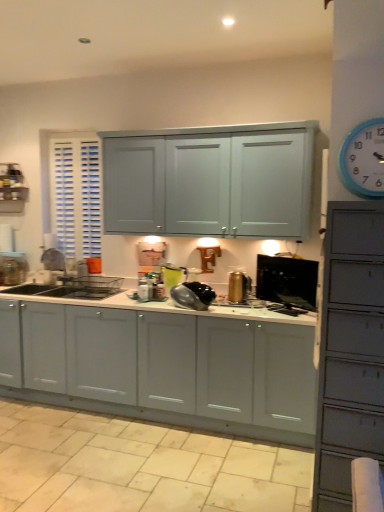
Locate an element on the screen. The height and width of the screenshot is (512, 384). blank space above beige tile at lower center (from a real-world perspective) is located at coordinates (135, 468).